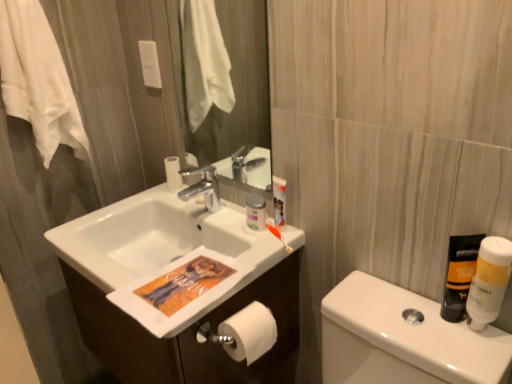
The image size is (512, 384). I want to click on vacant space to the left of matte plastic container at upper center, so click(x=216, y=213).